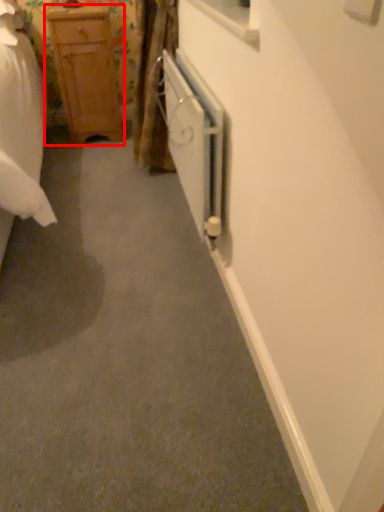
Question: Considering the relative positions of chest of drawers (annotated by the red box) and screen door in the image provided, where is chest of drawers (annotated by the red box) located with respect to the staircase?

Choices:
 (A) right
 (B) left

Answer: (B)